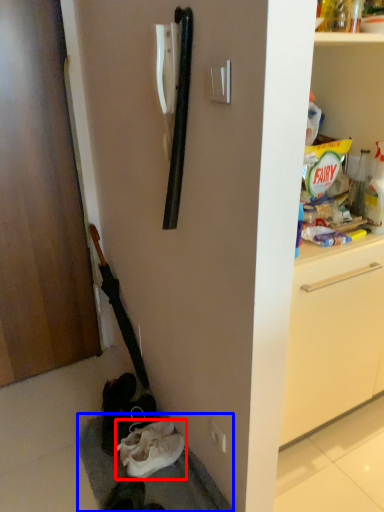
Question: Which point is further to the camera, shoe (highlighted by a red box) or gray (highlighted by a blue box)?

Choices:
 (A) shoe
 (B) gray

Answer: (A)